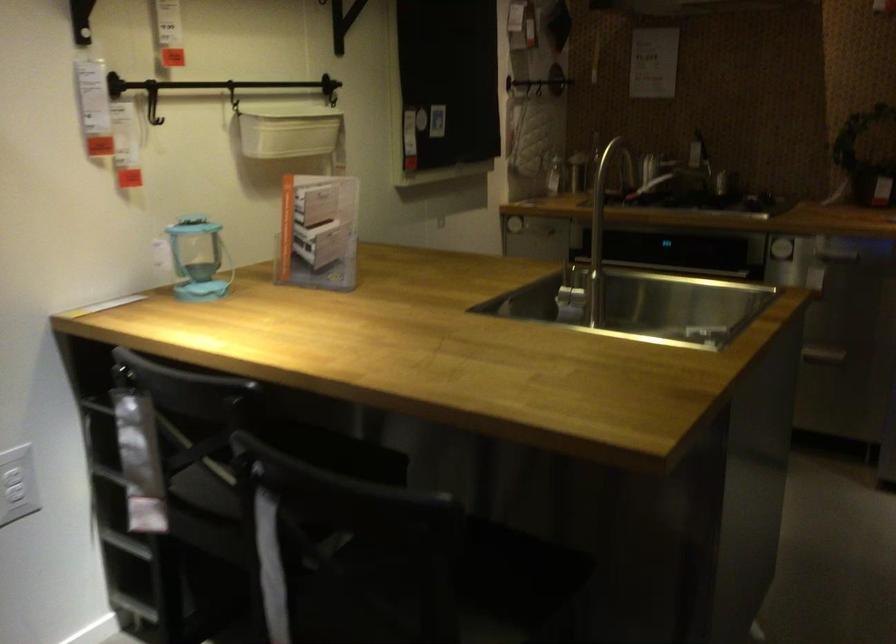
Find where to lift the acrylic brochure holder. Please return your answer as a coordinate pair (x, y).

(317, 232)